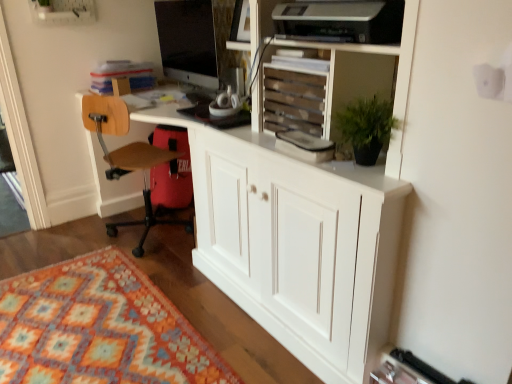
Question: Visually, is matte black monitor at upper center positioned to the left or to the right of multicolored woven rug at lower left?

Choices:
 (A) left
 (B) right

Answer: (B)

Question: In terms of width, does matte black monitor at upper center look wider or thinner when compared to multicolored woven rug at lower left?

Choices:
 (A) wide
 (B) thin

Answer: (B)

Question: Considering the real-world distances, which object is closest to the wooden slats at upper center?

Choices:
 (A) multicolored woven rug at lower left
 (B) matte black monitor at upper center
 (C) brown wood chair at left

Answer: (B)

Question: Which object is positioned farthest from the multicolored woven rug at lower left?

Choices:
 (A) brown wood chair at left
 (B) matte black monitor at upper center
 (C) wooden slats at upper center

Answer: (B)